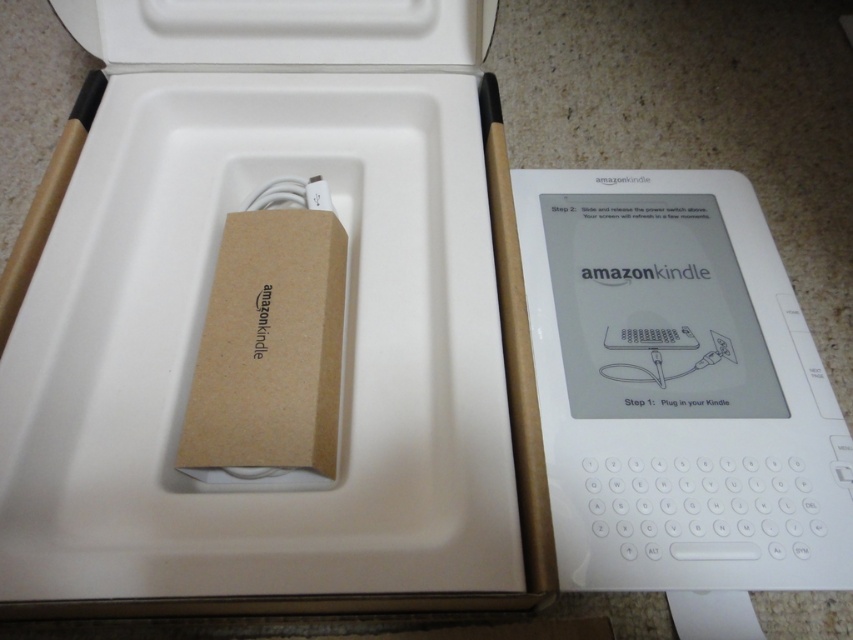
Question: Which of the following is the farthest from the observer?

Choices:
 (A) white plastic kindle at right
 (B) brown/kraft paper amazonkindle at center

Answer: (A)

Question: Where is brown/kraft paper amazonkindle at center located in relation to white plastic kindle at right in the image?

Choices:
 (A) right
 (B) left

Answer: (B)

Question: Does brown/kraft paper amazonkindle at center appear on the left side of white plastic kindle at right?

Choices:
 (A) yes
 (B) no

Answer: (A)

Question: Which point appears closest to the camera in this image?

Choices:
 (A) (4, 404)
 (B) (527, 186)

Answer: (A)

Question: Which point is farther to the camera?

Choices:
 (A) brown/kraft paper amazonkindle at center
 (B) white plastic kindle at right

Answer: (B)

Question: Can you confirm if brown/kraft paper amazonkindle at center is positioned above white plastic kindle at right?

Choices:
 (A) no
 (B) yes

Answer: (B)